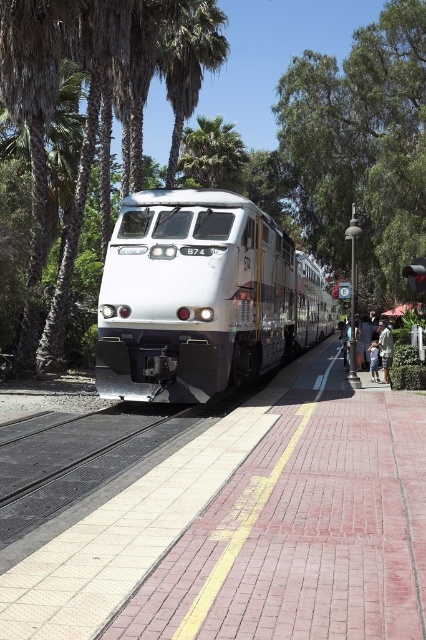
Question: Observing the image, what is the correct spatial positioning of silver metallic train at center in reference to light brown leather jacket at lower right?

Choices:
 (A) below
 (B) above

Answer: (B)

Question: Does green leafy tree at upper center have a greater width compared to green leafy tree at center?

Choices:
 (A) yes
 (B) no

Answer: (B)

Question: In this image, where is silver metallic train at center located relative to light brown leather jacket at lower right?

Choices:
 (A) below
 (B) above

Answer: (B)

Question: Which of the following is the farthest from the observer?

Choices:
 (A) green leafy palm tree at center
 (B) green leafy tree at upper center
 (C) silver metallic train at center

Answer: (A)

Question: Which of the following is the farthest from the observer?

Choices:
 (A) green leafy palm tree at center
 (B) light brown leather jacket at lower right

Answer: (A)

Question: Which point is farther to the camera?

Choices:
 (A) green leafy tree at upper center
 (B) silver metallic train at center
 (C) green leafy palm tree at center
 (D) light brown leather jacket at lower right

Answer: (C)